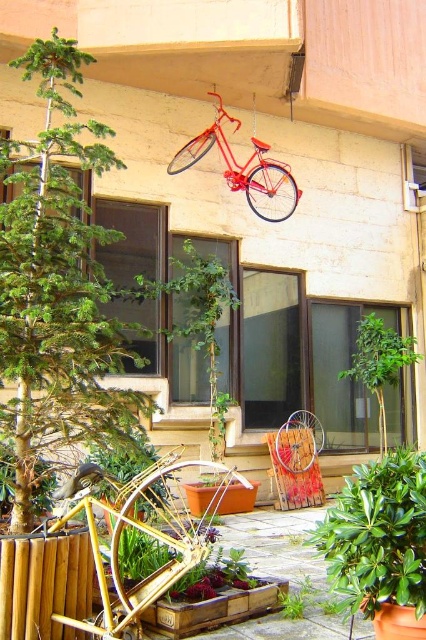
You are a gardener standing at the center of the garden area. You need to place a new decorative stone exactly at the center of the garden area. However, there is a green glossy plant at lower right in the way. Where should you move the green glossy plant to avoid blocking the stone?

The green glossy plant at lower right is currently at point (377, 536). To avoid blocking the stone at the center, move it to a position away from the center, such as point (127, 448).

Consider the image. You are designing a garden layout and need to place the green glossy plant at lower right and the green leafy tree at center. Which of these two plants has a wider trunk or base?

The green leafy tree at center has a wider trunk or base than the green glossy plant at lower right.

You are a gardener who wants to water the green glossy plant at lower right and the green leafy tree at center. Since you have a limited amount of water, you need to prioritize based on their positions. Which one is closer to the water source located at the bottom of the image?

The green glossy plant at lower right is closer to the water source located at the bottom of the image because it is positioned below the green leafy tree at center.